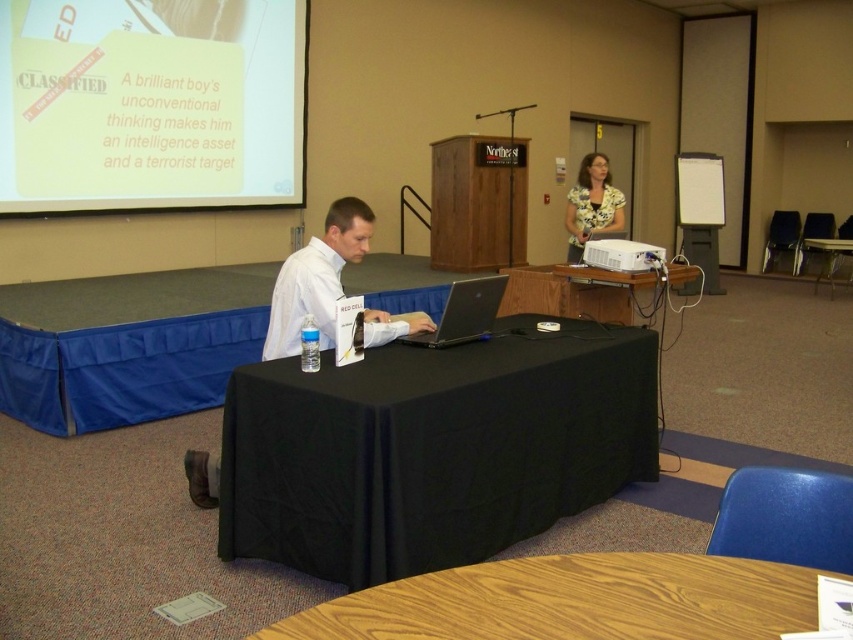
You are an attendee in the conference room. You see the black fabric table at center and the black matte laptop at center. Which object is closer to you?

The black fabric table at center is closer to you because it is in front of the black matte laptop at center.

You are an attendee at the conference. You notice a point marked at coordinates (590, 204) in the image. Based on the scene description, can you identify what object or part of the scene this point corresponds to?

The point at coordinates (590, 204) corresponds to the matte yellow blouse at upper right.